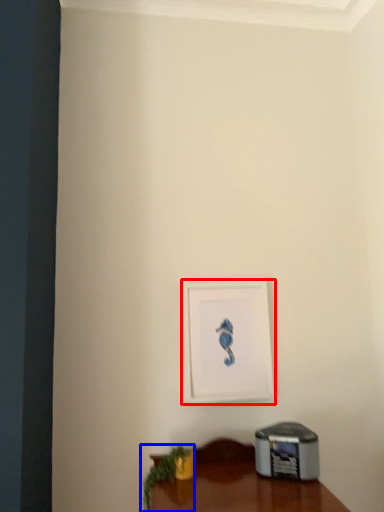
Question: Which object is closer to the camera taking this photo, picture frame (highlighted by a red box) or plant (highlighted by a blue box)?

Choices:
 (A) picture frame
 (B) plant

Answer: (B)